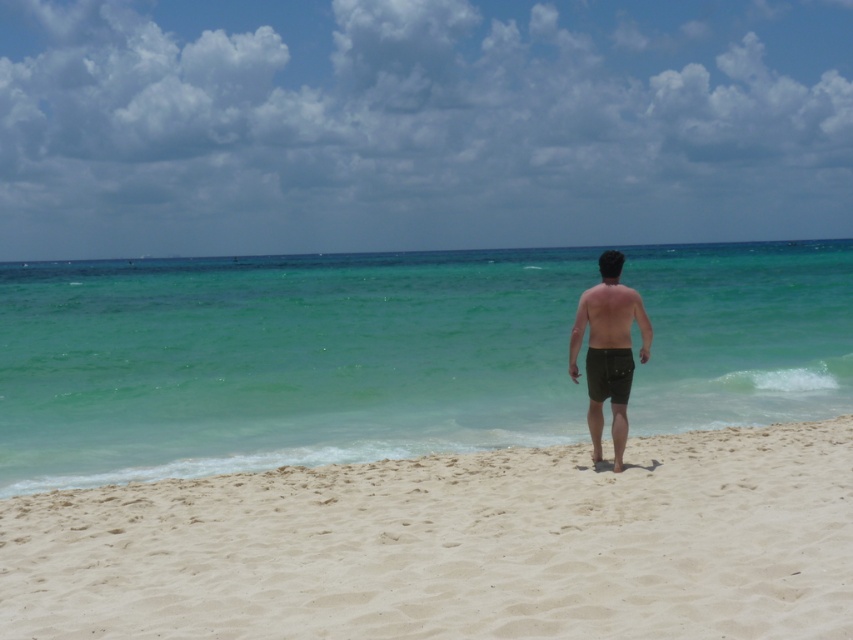
Which of these two, brown cotton shorts at center or brown matte shorts at center, stands taller?

brown cotton shorts at center is taller.

Which is more to the left, brown cotton shorts at center or brown matte shorts at center?

brown matte shorts at center

Identify the location of brown cotton shorts at center. (608, 349).

Find the location of a particular element. The image size is (853, 640). brown cotton shorts at center is located at coordinates (608, 349).

Which is in front, point (512, 362) or point (602, 390)?

Point (602, 390) is more forward.

Can you confirm if clear water at center is shorter than black matte shorts at center?

In fact, clear water at center may be taller than black matte shorts at center.

Locate an element on the screen. clear water at center is located at coordinates (281, 362).

Is point (235, 628) positioned behind point (618, 275)?

No, it is in front of (618, 275).

Which is more to the left, white sandy beach at center or brown cotton shorts at center?

brown cotton shorts at center

The image size is (853, 640). Describe the element at coordinates (456, 545) in the screenshot. I see `white sandy beach at center` at that location.

The width and height of the screenshot is (853, 640). In order to click on white sandy beach at center in this screenshot , I will do `click(456, 545)`.